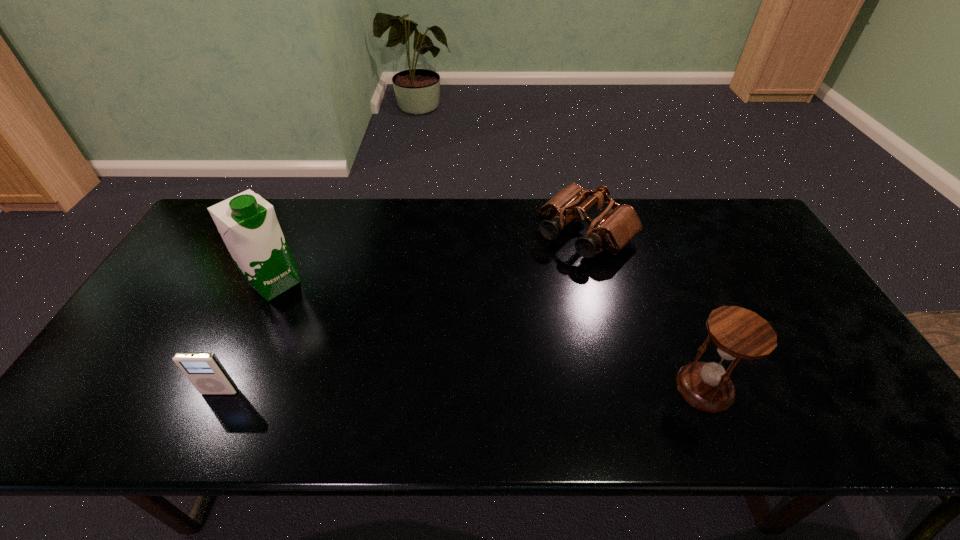
Identify the location of vacant spot on the desktop that is between the iPod and the hourglass and is positioned through the eyepieces of the binoculars. The width and height of the screenshot is (960, 540). (423, 390).

Find the location of a particular element. This screenshot has height=540, width=960. free spot on the desktop that is between the iPod and the third shortest object and is positioned on the front-facing side of the tallest object is located at coordinates click(x=397, y=390).